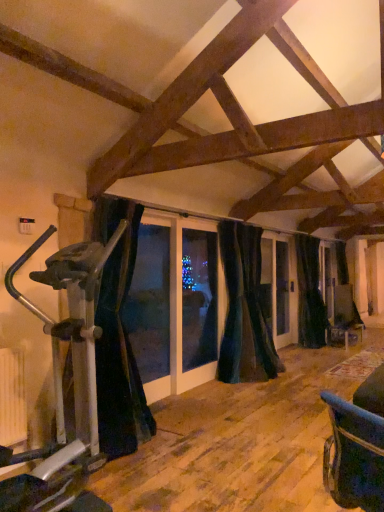
Question: Is black fabric curtain at left, positioned as the third curtain in right-to-left order, at the right side of black velvet curtain at right, the first curtain positioned from the back?

Choices:
 (A) no
 (B) yes

Answer: (A)

Question: From a real-world perspective, is black fabric curtain at left, the 3th curtain in the back-to-front sequence, physically above black velvet curtain at right, the 3th curtain positioned from the left?

Choices:
 (A) yes
 (B) no

Answer: (A)

Question: From the image's perspective, is black fabric curtain at left, positioned as the third curtain in right-to-left order, under black velvet curtain at right, the 3th curtain positioned from the left?

Choices:
 (A) no
 (B) yes

Answer: (A)

Question: Is black fabric curtain at left, the 3th curtain in the back-to-front sequence, oriented away from black velvet curtain at right, the first curtain positioned from the back?

Choices:
 (A) no
 (B) yes

Answer: (A)

Question: Considering the relative sizes of black fabric curtain at left, placed as the 1th curtain when sorted from left to right, and black velvet curtain at right, the first curtain from the right, in the image provided, is black fabric curtain at left, placed as the 1th curtain when sorted from left to right, shorter than black velvet curtain at right, the first curtain from the right,?

Choices:
 (A) no
 (B) yes

Answer: (B)

Question: Is black fabric curtain at left, positioned as the third curtain in right-to-left order, bigger than black velvet curtain at right, the third curtain when ordered from front to back?

Choices:
 (A) no
 (B) yes

Answer: (B)

Question: From a real-world perspective, is black velvet curtain at right, the first curtain positioned from the back, below black fabric curtain at left, positioned as the third curtain in right-to-left order?

Choices:
 (A) yes
 (B) no

Answer: (A)

Question: From a real-world perspective, is black velvet curtain at right, the first curtain positioned from the back, on top of black fabric curtain at left, placed as the 1th curtain when sorted from left to right?

Choices:
 (A) yes
 (B) no

Answer: (B)

Question: Is black velvet curtain at right, the 3th curtain positioned from the left, oriented away from black fabric curtain at left, positioned as the third curtain in right-to-left order?

Choices:
 (A) yes
 (B) no

Answer: (B)

Question: Is the position of black velvet curtain at right, the first curtain positioned from the back, less distant than that of black fabric curtain at left, the 3th curtain in the back-to-front sequence?

Choices:
 (A) no
 (B) yes

Answer: (A)

Question: Would you say black fabric curtain at left, the 3th curtain in the back-to-front sequence, is part of black velvet curtain at right, the first curtain from the right,'s contents?

Choices:
 (A) yes
 (B) no

Answer: (B)

Question: Would you consider black velvet curtain at right, the first curtain positioned from the back, to be distant from black fabric curtain at left, placed as the 1th curtain when sorted from left to right?

Choices:
 (A) no
 (B) yes

Answer: (B)

Question: From the image's perspective, is dark velvet curtain at center, which is the second curtain from right to left, located above silver metallic stationary bicycle at left?

Choices:
 (A) yes
 (B) no

Answer: (A)